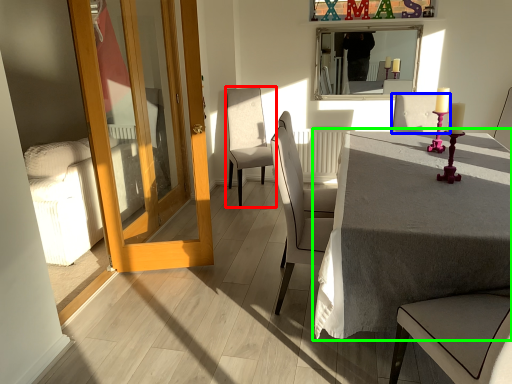
Question: Estimate the real-world distances between objects in this image. Which object is farther from chair (highlighted by a red box), chair (highlighted by a blue box) or table (highlighted by a green box)?

Choices:
 (A) chair
 (B) table

Answer: (B)